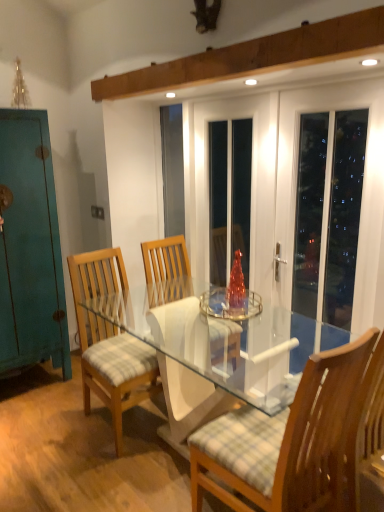
I want to click on vacant region in front of light brown wood chair at center, which ranks as the 2th chair in front-to-back order, so click(107, 474).